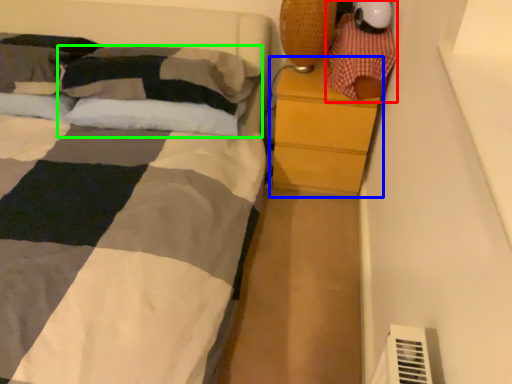
Question: Which object is positioned closest to toy (highlighted by a red box)? Select from chest of drawers (highlighted by a blue box) and pillow (highlighted by a green box).

Choices:
 (A) chest of drawers
 (B) pillow

Answer: (A)